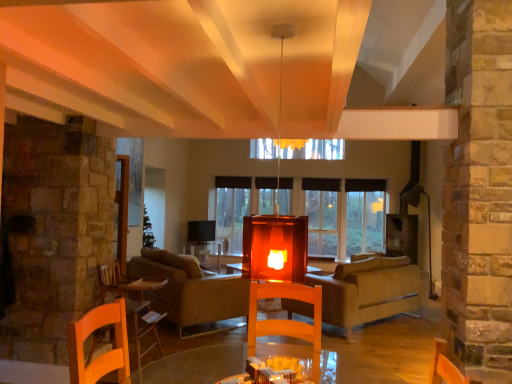
Question: From the image's perspective, is transparent glass window at center located above or below velvet beige couch at center?

Choices:
 (A) below
 (B) above

Answer: (B)

Question: From a real-world perspective, is transparent glass window at center positioned above or below velvet beige couch at center?

Choices:
 (A) above
 (B) below

Answer: (A)

Question: Estimate the real-world distances between objects in this image. Which object is closer to the wooden table at lower left?

Choices:
 (A) transparent glass window at center
 (B) velvet beige couch at center
 (C) beige fabric couch at center

Answer: (B)

Question: Estimate the real-world distances between objects in this image. Which object is farther from the velvet beige couch at center?

Choices:
 (A) transparent glass window at center
 (B) beige fabric couch at center
 (C) wooden table at lower left

Answer: (A)